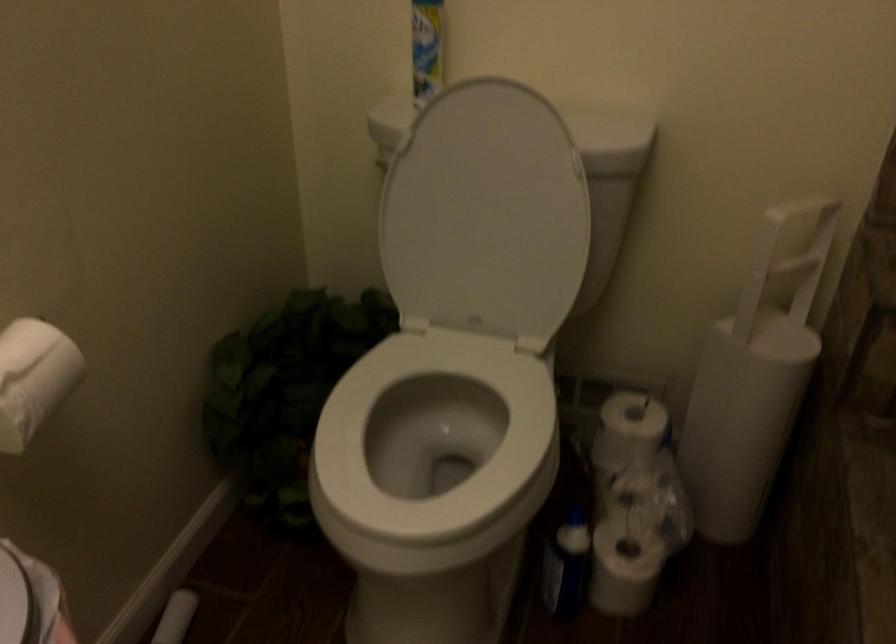
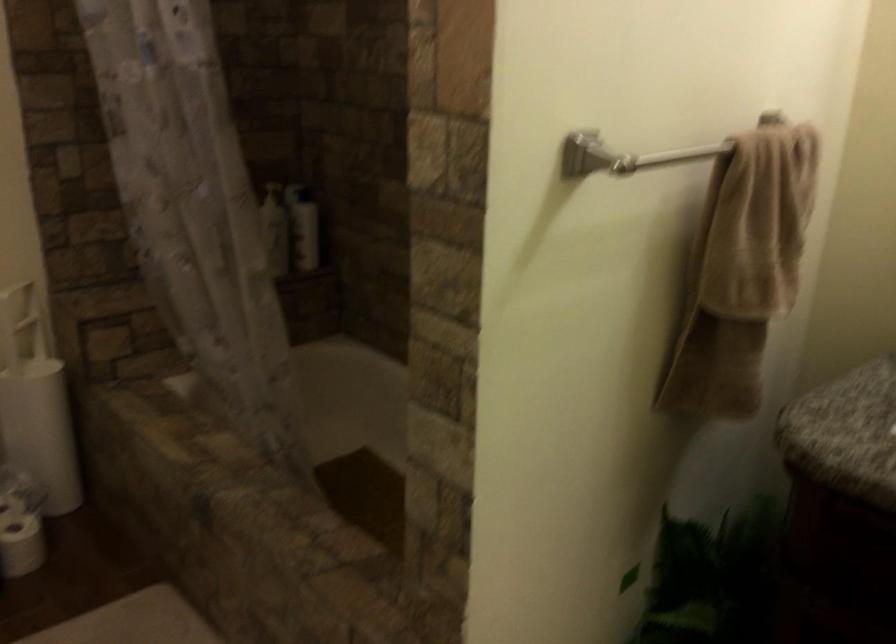
The point at [626,550] is marked in the first image. Where is the corresponding point in the second image?

(20, 524)